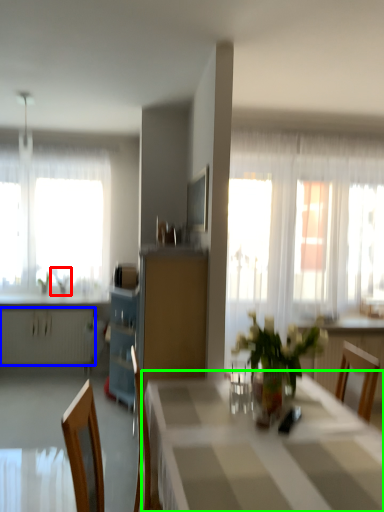
Question: Estimate the real-world distances between objects in this image. Which object is closer to plant (highlighted by a red box), radiator (highlighted by a blue box) or table (highlighted by a green box)?

Choices:
 (A) radiator
 (B) table

Answer: (A)